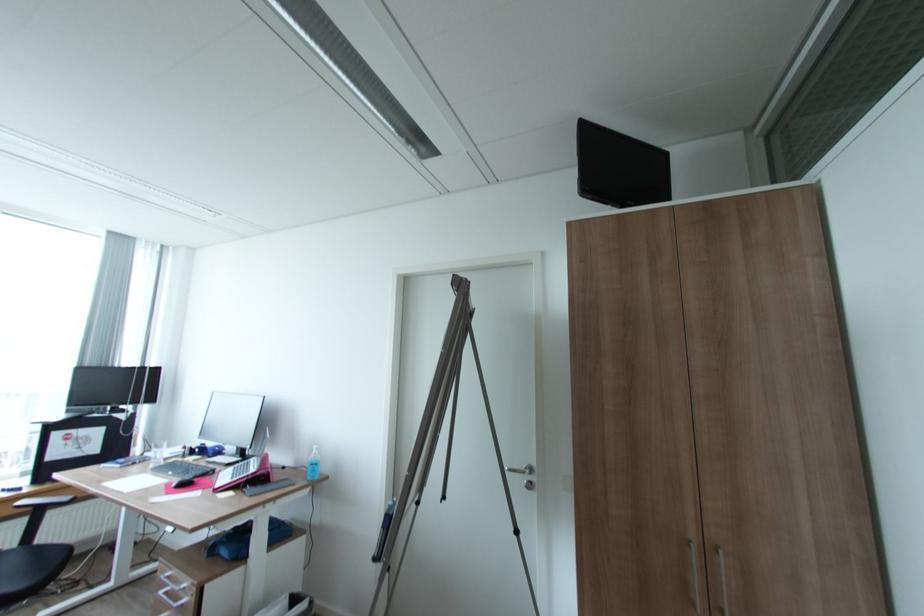
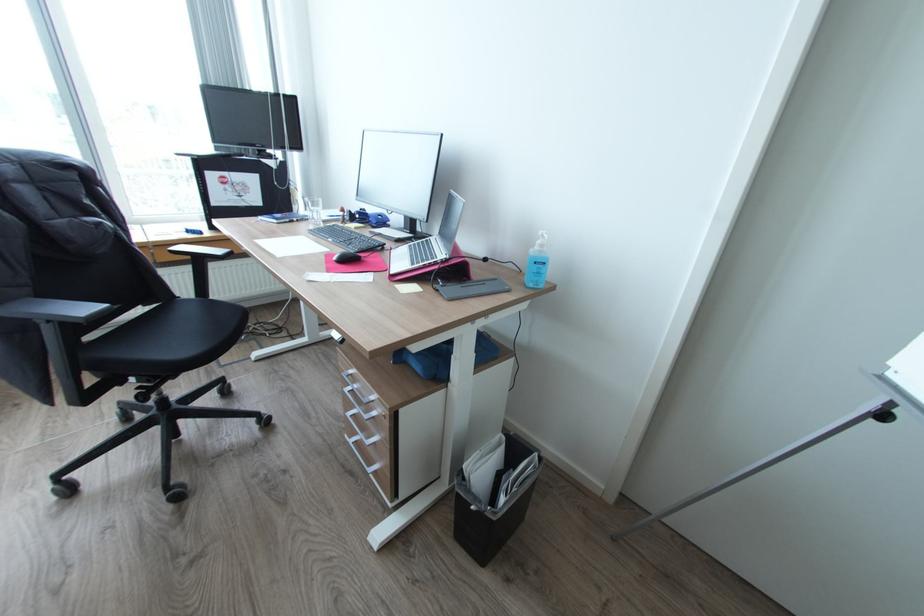
Where in the second image is the point corresponding to point (314, 477) from the first image?

(536, 284)